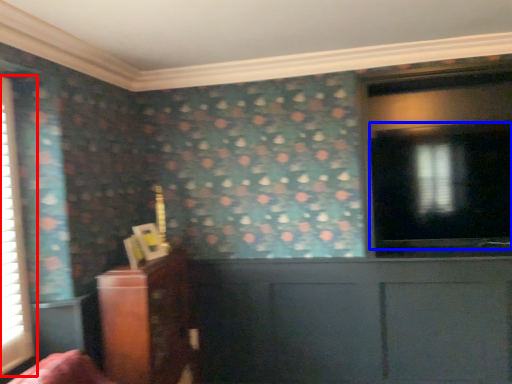
Question: Which object appears farthest to the camera in this image, window (highlighted by a red box) or window screen (highlighted by a blue box)?

Choices:
 (A) window
 (B) window screen

Answer: (B)